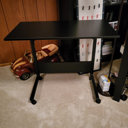
Identify the location of bookshelf. The width and height of the screenshot is (128, 128). (118, 13).